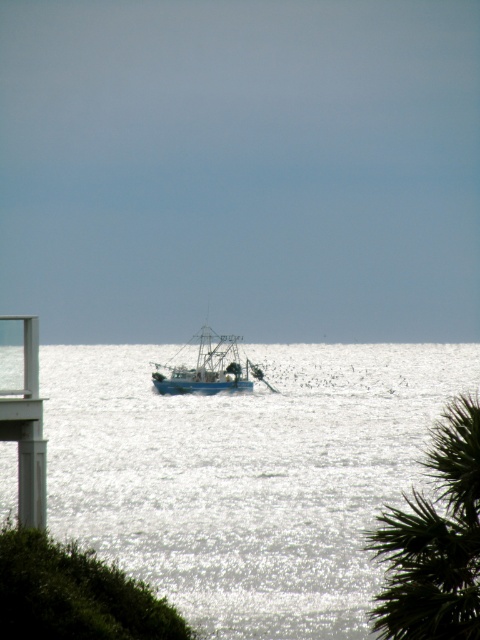
Can you confirm if green leafy palm tree at lower right is bigger than blue matte fishing boat at center?

No.

Who is shorter, green leafy palm tree at lower right or blue matte fishing boat at center?

With less height is blue matte fishing boat at center.

Is point (468, 524) positioned after point (240, 380)?

That is False.

Where is `green leafy palm tree at lower right`? This screenshot has height=640, width=480. green leafy palm tree at lower right is located at coordinates (435, 541).

Which is more to the left, glistening silver water at center or green leafy palm tree at lower right?

glistening silver water at center is more to the left.

Is point (106, 525) behind point (432, 541)?

Yes, it is.

This screenshot has height=640, width=480. I want to click on glistening silver water at center, so click(245, 476).

Is glistening silver water at center behind blue matte fishing boat at center?

No, glistening silver water at center is in front of blue matte fishing boat at center.

The width and height of the screenshot is (480, 640). What do you see at coordinates (245, 476) in the screenshot?
I see `glistening silver water at center` at bounding box center [245, 476].

Find the location of a particular element. This screenshot has width=480, height=640. glistening silver water at center is located at coordinates (245, 476).